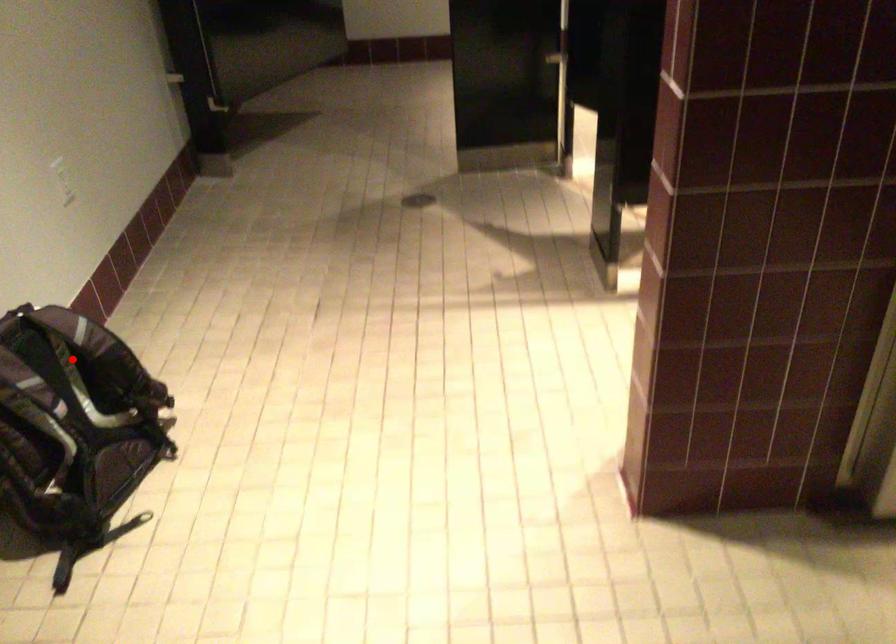
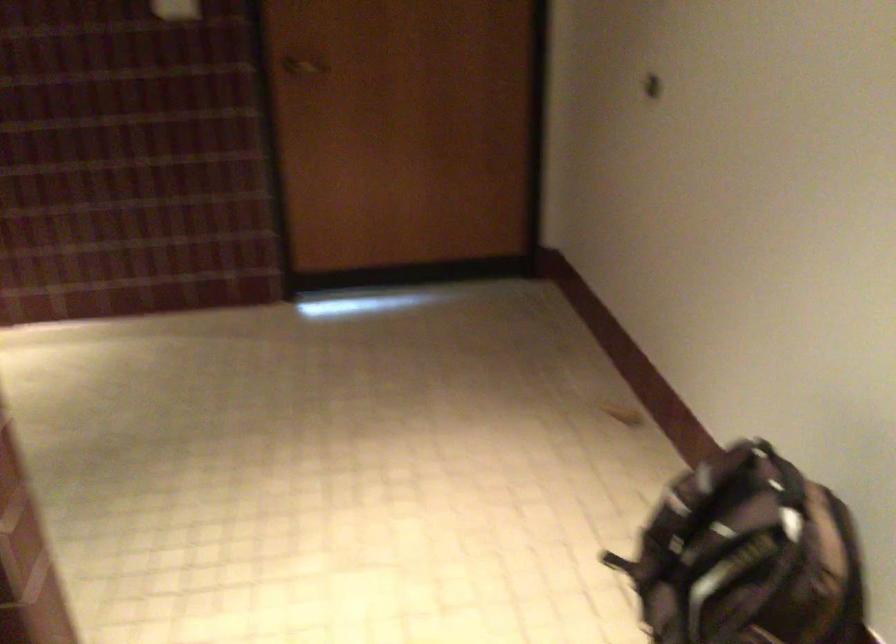
Find the pixel in the second image that matches the highlighted location in the first image.

(748, 556)